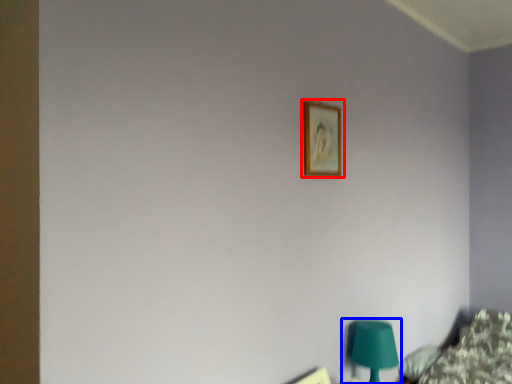
Question: Which object is closer to the camera taking this photo, picture frame (highlighted by a red box) or table lamp (highlighted by a blue box)?

Choices:
 (A) picture frame
 (B) table lamp

Answer: (A)